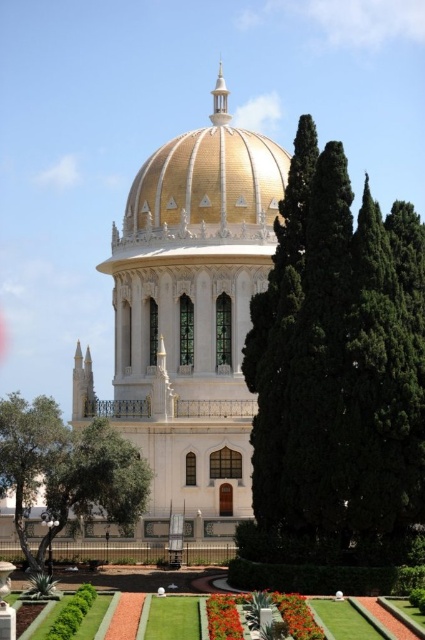
Question: Observing the image, what is the correct spatial positioning of white marble palace at center in reference to gold glossy dome at center?

Choices:
 (A) below
 (B) above

Answer: (A)

Question: Which point is farther to the camera?

Choices:
 (A) (294, 620)
 (B) (221, 634)
 (C) (209, 621)
 (D) (40, 472)

Answer: (D)

Question: Among these points, which one is farthest from the camera?

Choices:
 (A) (316, 260)
 (B) (215, 600)
 (C) (275, 600)

Answer: (A)

Question: Where is green leafy tree at center located in relation to white marble palace at center in the image?

Choices:
 (A) right
 (B) left

Answer: (A)

Question: Which point is farther to the camera?

Choices:
 (A) (221, 602)
 (B) (283, 248)
 (C) (70, 433)

Answer: (C)

Question: Is green grass at lower center further to camera compared to smooth red flower at lower center?

Choices:
 (A) yes
 (B) no

Answer: (B)